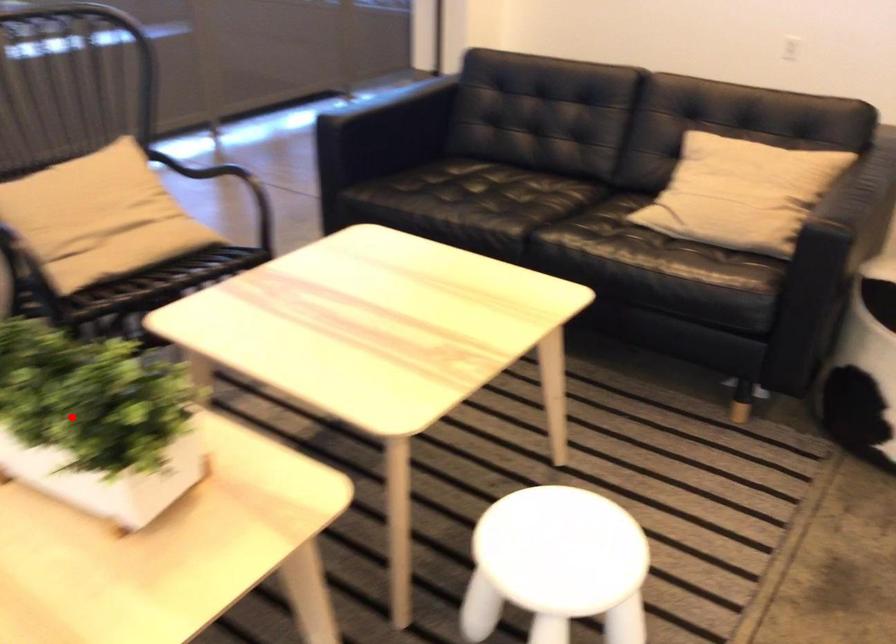
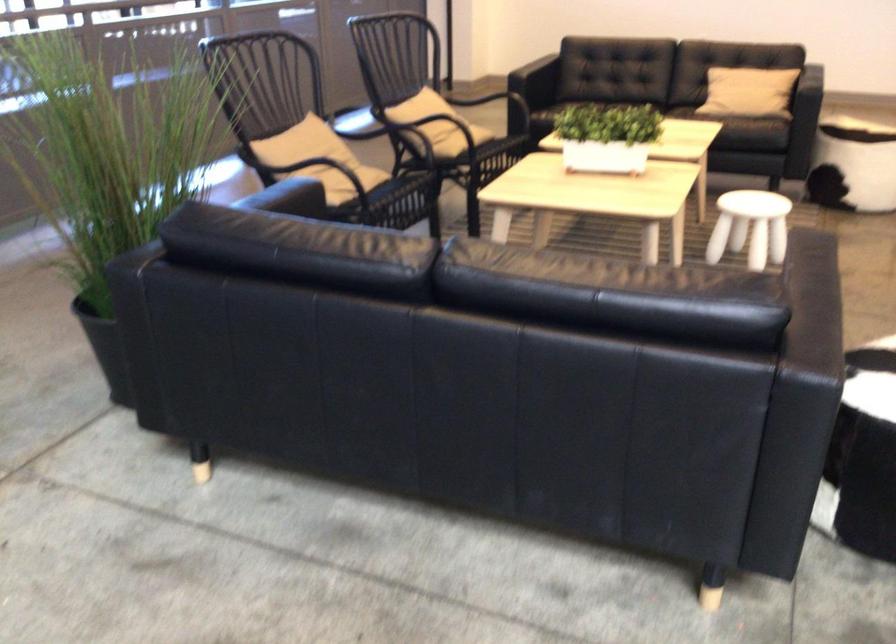
Question: I am providing you with two images of the same scene from different viewpoints. Given a red point in image1, look at the same physical point in image2. Is it:

Choices:
 (A) Closer to the viewpoint
 (B) Farther from the viewpoint

Answer: (B)